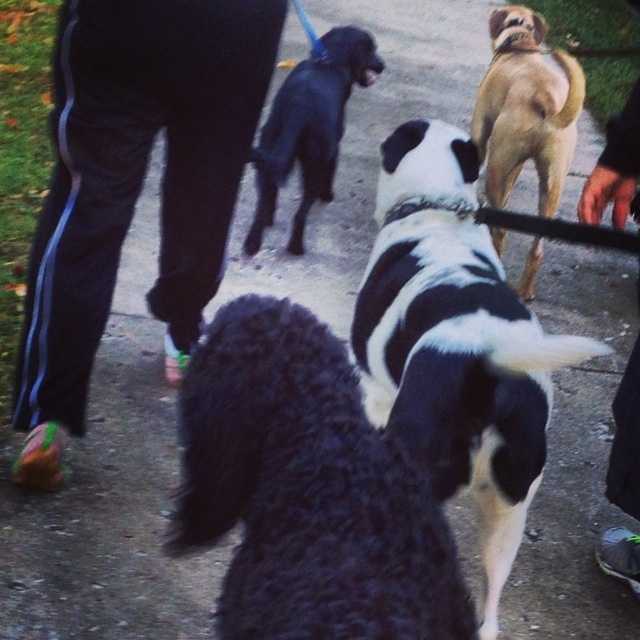
Does point (92, 19) lie behind point (493, 182)?

That is False.

Between black track pants at center and tan smooth coat dog at upper right, which one has more height?

tan smooth coat dog at upper right is taller.

Is point (84, 76) positioned before point (557, 51)?

Yes, it is.

Identify the location of black track pants at center. 132,188.

Does point (176, 515) come in front of point (596, 176)?

That is True.

Can you confirm if fluffy black dog at center is bigger than black fabric pants at lower right?

Indeed, fluffy black dog at center has a larger size compared to black fabric pants at lower right.

Which is behind, point (307, 344) or point (625, 381)?

Positioned behind is point (625, 381).

Identify the location of fluffy black dog at center. (307, 490).

Between black and white fur at center and tan smooth coat dog at upper right, which one has less height?

black and white fur at center is shorter.

Does black and white fur at center come in front of tan smooth coat dog at upper right?

Yes, black and white fur at center is closer to the viewer.

Is point (456, 129) in front of point (476, 113)?

That is True.

Identify the location of black and white fur at center. (456, 342).